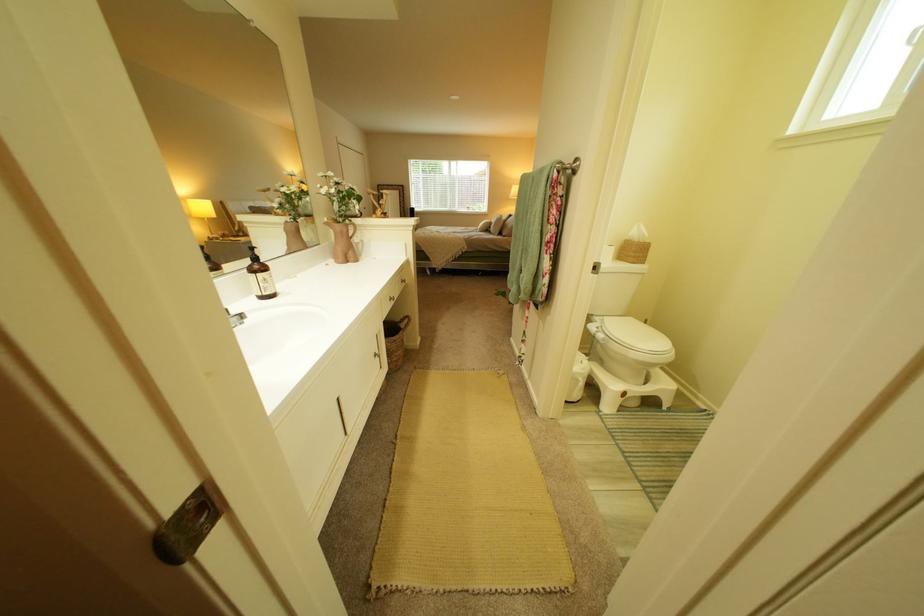
In order to click on brown dispenser pump in this screenshot , I will do `click(256, 264)`.